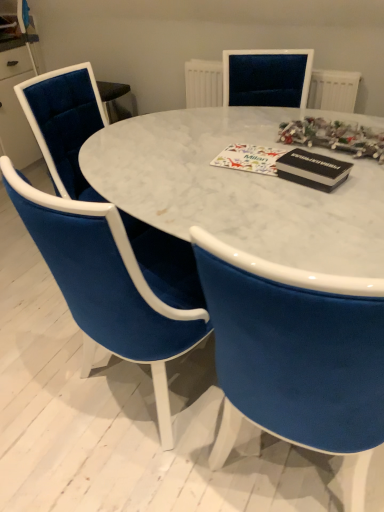
Where is `white matte christmas card at center`? The height and width of the screenshot is (512, 384). white matte christmas card at center is located at coordinates (249, 158).

Image resolution: width=384 pixels, height=512 pixels. Describe the element at coordinates (249, 158) in the screenshot. I see `white matte christmas card at center` at that location.

Locate an element on the screen. The height and width of the screenshot is (512, 384). velvet blue chair at center, placed as the second chair when sorted from back to front is located at coordinates (107, 284).

What do you see at coordinates (333, 90) in the screenshot? I see `white textured radiator at upper center` at bounding box center [333, 90].

You are a GUI agent. You are given a task and a screenshot of the screen. Output one action in this format:
    pyautogui.click(x=<x>, y=<y>)
    Task: Click on the white marble table at center
    The height and width of the screenshot is (512, 384).
    Given the screenshot: What is the action you would take?
    (240, 188)

Is black matte magazine at upper right closer to the viewer compared to white matte christmas card at center?

Yes, the depth of black matte magazine at upper right is less than that of white matte christmas card at center.

From a real-world perspective, is black matte magazine at upper right above or below white matte christmas card at center?

black matte magazine at upper right is situated higher than white matte christmas card at center in the real world.

Which is more to the right, black matte magazine at upper right or white matte christmas card at center?

black matte magazine at upper right is more to the right.

From a real-world perspective, which object rests below the other?

white marble table at center.

Does velvet blue chair at center, placed as the second chair when sorted from back to front, have a smaller size compared to white marble table at center?

Yes.

How many degrees apart are the facing directions of velvet blue chair at center, which ranks as the 1th chair in front-to-back order, and white marble table at center?

There is a 71.4-degree angle between the facing directions of velvet blue chair at center, which ranks as the 1th chair in front-to-back order, and white marble table at center.

Is velvet blue chair at center, which ranks as the 1th chair in front-to-back order, at the left side of white marble table at center?

Yes, velvet blue chair at center, which ranks as the 1th chair in front-to-back order, is to the left of white marble table at center.

What's the angular difference between white marble table at center and black matte magazine at upper right's facing directions?

The angular difference between white marble table at center and black matte magazine at upper right is 19.6 degrees.

Is white marble table at center facing away from black matte magazine at upper right?

No, black matte magazine at upper right is not at the back of white marble table at center.

From the image's perspective, is white marble table at center beneath black matte magazine at upper right?

Indeed, from the image's perspective, white marble table at center is shown beneath black matte magazine at upper right.

Is black matte magazine at upper right surrounded by white marble table at center?

No, black matte magazine at upper right is not a part of white marble table at center.

Considering the relative positions of white textured radiator at upper center and white marble table at center in the image provided, is white textured radiator at upper center to the right of white marble table at center from the viewer's perspective?

Correct, you'll find white textured radiator at upper center to the right of white marble table at center.

Based on the photo, is white textured radiator at upper center outside of white marble table at center?

Absolutely, white textured radiator at upper center is external to white marble table at center.

Is white textured radiator at upper center taller or shorter than white marble table at center?

white textured radiator at upper center is shorter than white marble table at center.

Between white textured radiator at upper center and white marble table at center, which one has larger width?

Wider between the two is white marble table at center.

Does black matte magazine at upper right have a larger size compared to velvet blue chair at lower left, marked as the second chair in a front-to-back arrangement?

No.

Is black matte magazine at upper right closer to the viewer compared to velvet blue chair at lower left, positioned as the 1th chair in back-to-front order?

That is True.

The width and height of the screenshot is (384, 512). In order to click on magazine in front of the velvet blue chair at lower left, marked as the second chair in a front-to-back arrangement in this screenshot , I will do `click(312, 170)`.

Considering the relative positions of black matte magazine at upper right and velvet blue chair at lower left, marked as the second chair in a front-to-back arrangement, in the image provided, is black matte magazine at upper right to the right of velvet blue chair at lower left, marked as the second chair in a front-to-back arrangement, from the viewer's perspective?

Indeed, black matte magazine at upper right is positioned on the right side of velvet blue chair at lower left, marked as the second chair in a front-to-back arrangement.

From the image's perspective, is velvet blue chair at lower left, marked as the second chair in a front-to-back arrangement, above black matte magazine at upper right?

Yes, from the image's perspective, velvet blue chair at lower left, marked as the second chair in a front-to-back arrangement, is on top of black matte magazine at upper right.

Considering the relative sizes of velvet blue chair at lower left, positioned as the 1th chair in back-to-front order, and black matte magazine at upper right in the image provided, is velvet blue chair at lower left, positioned as the 1th chair in back-to-front order, shorter than black matte magazine at upper right?

No.

From the picture: Can you tell me how much velvet blue chair at lower left, marked as the second chair in a front-to-back arrangement, and black matte magazine at upper right differ in facing direction?

The angle between the facing direction of velvet blue chair at lower left, marked as the second chair in a front-to-back arrangement, and the facing direction of black matte magazine at upper right is 17.5 degrees.

Which object is wider, velvet blue chair at lower left, marked as the second chair in a front-to-back arrangement, or black matte magazine at upper right?

Wider between the two is velvet blue chair at lower left, marked as the second chair in a front-to-back arrangement.

Can you tell me how much velvet blue chair at lower left, marked as the second chair in a front-to-back arrangement, and white matte christmas card at center differ in facing direction?

They differ by 1.41 degrees in their facing directions.

Does velvet blue chair at lower left, marked as the second chair in a front-to-back arrangement, turn towards white matte christmas card at center?

Yes.

Does velvet blue chair at lower left, positioned as the 1th chair in back-to-front order, touch white matte christmas card at center?

No, velvet blue chair at lower left, positioned as the 1th chair in back-to-front order, is not in contact with white matte christmas card at center.

From a real-world perspective, relative to white matte christmas card at center, is velvet blue chair at lower left, marked as the second chair in a front-to-back arrangement, vertically above or below?

velvet blue chair at lower left, marked as the second chair in a front-to-back arrangement, is below white matte christmas card at center.

Where is `christmas card behind the black matte magazine at upper right`? christmas card behind the black matte magazine at upper right is located at coordinates 249,158.

Find the location of a particular element. This screenshot has width=384, height=512. table that appears below the velvet blue chair at center, placed as the second chair when sorted from back to front (from a real-world perspective) is located at coordinates (240, 188).

Looking at the image, which one is located further to velvet blue chair at lower left, marked as the second chair in a front-to-back arrangement, black matte magazine at upper right or velvet blue chair at center, which ranks as the 1th chair in front-to-back order?

black matte magazine at upper right is positioned further to the anchor velvet blue chair at lower left, marked as the second chair in a front-to-back arrangement.

Looking at the image, which one is located closer to white marble table at center, white matte christmas card at center or velvet blue chair at center, which ranks as the 1th chair in front-to-back order?

The object closer to white marble table at center is white matte christmas card at center.

Considering their positions, is velvet blue chair at lower left, marked as the second chair in a front-to-back arrangement, positioned further to black matte magazine at upper right than white matte christmas card at center?

The object further to black matte magazine at upper right is velvet blue chair at lower left, marked as the second chair in a front-to-back arrangement.

Considering their positions, is white marble table at center positioned further to velvet blue chair at lower left, positioned as the 1th chair in back-to-front order, than black matte magazine at upper right?

black matte magazine at upper right.

From the image, which object appears to be farther from white marble table at center, white matte christmas card at center or white textured radiator at upper center?

white textured radiator at upper center is further to white marble table at center.

Considering their positions, is white marble table at center positioned closer to white matte christmas card at center than velvet blue chair at lower left, marked as the second chair in a front-to-back arrangement?

Among the two, white marble table at center is located nearer to white matte christmas card at center.

From the image, which object appears to be nearer to velvet blue chair at center, which ranks as the 1th chair in front-to-back order, white marble table at center or black matte magazine at upper right?

white marble table at center lies closer to velvet blue chair at center, which ranks as the 1th chair in front-to-back order, than the other object.

Based on their spatial positions, is white textured radiator at upper center or velvet blue chair at lower left, marked as the second chair in a front-to-back arrangement, closer to velvet blue chair at center, placed as the second chair when sorted from back to front?

velvet blue chair at lower left, marked as the second chair in a front-to-back arrangement, lies closer to velvet blue chair at center, placed as the second chair when sorted from back to front, than the other object.

Locate an element on the screen. This screenshot has height=512, width=384. magazine between velvet blue chair at lower left, marked as the second chair in a front-to-back arrangement, and white textured radiator at upper center from left to right is located at coordinates (312, 170).

Where is `chair between velvet blue chair at center, placed as the second chair when sorted from back to front, and white matte christmas card at center from front to back`? The image size is (384, 512). chair between velvet blue chair at center, placed as the second chair when sorted from back to front, and white matte christmas card at center from front to back is located at coordinates (64, 124).

Where is `table between velvet blue chair at lower left, positioned as the 1th chair in back-to-front order, and white matte christmas card at center`? This screenshot has height=512, width=384. table between velvet blue chair at lower left, positioned as the 1th chair in back-to-front order, and white matte christmas card at center is located at coordinates (240, 188).

Image resolution: width=384 pixels, height=512 pixels. Find the location of `magazine located between velvet blue chair at center, placed as the second chair when sorted from back to front, and white textured radiator at upper center in the depth direction`. magazine located between velvet blue chair at center, placed as the second chair when sorted from back to front, and white textured radiator at upper center in the depth direction is located at coordinates (x=312, y=170).